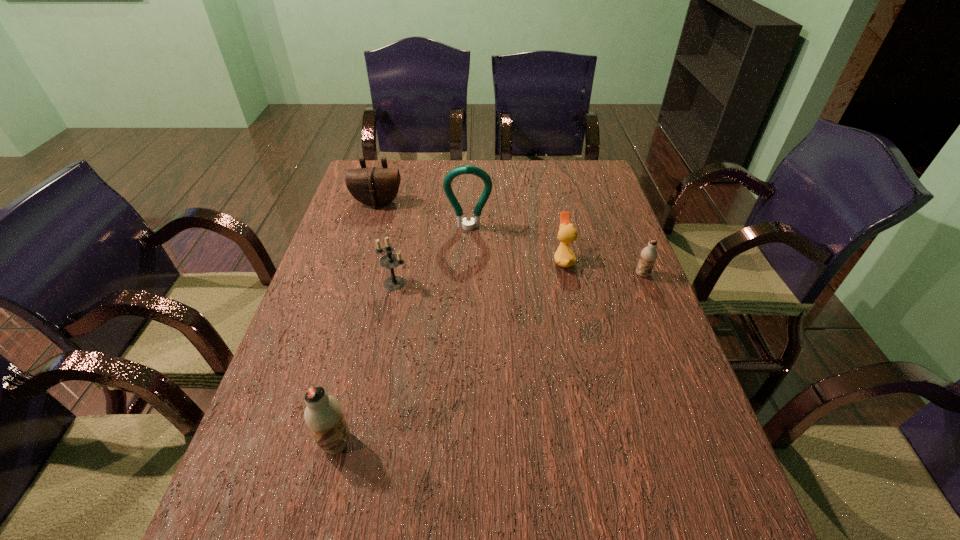
You are a GUI agent. You are given a task and a screenshot of the screen. Output one action in this format:
    pyautogui.click(x=<x>, y=<y>)
    Task: Click on the free space for an extra chocolate_milk to achieve even spacing
    The image size is (960, 540).
    Given the screenshot: What is the action you would take?
    pyautogui.click(x=516, y=344)